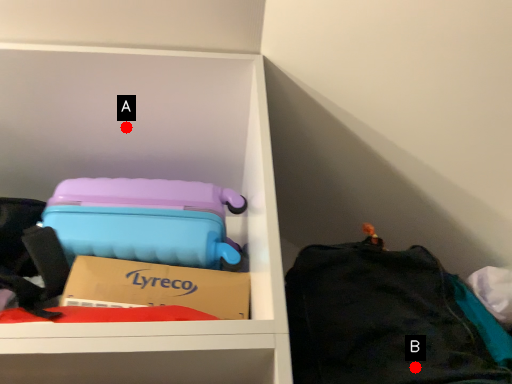
Question: Two points are circled on the image, labeled by A and B beside each circle. Which point appears farthest from the camera in this image?

Choices:
 (A) A is further
 (B) B is further

Answer: (A)